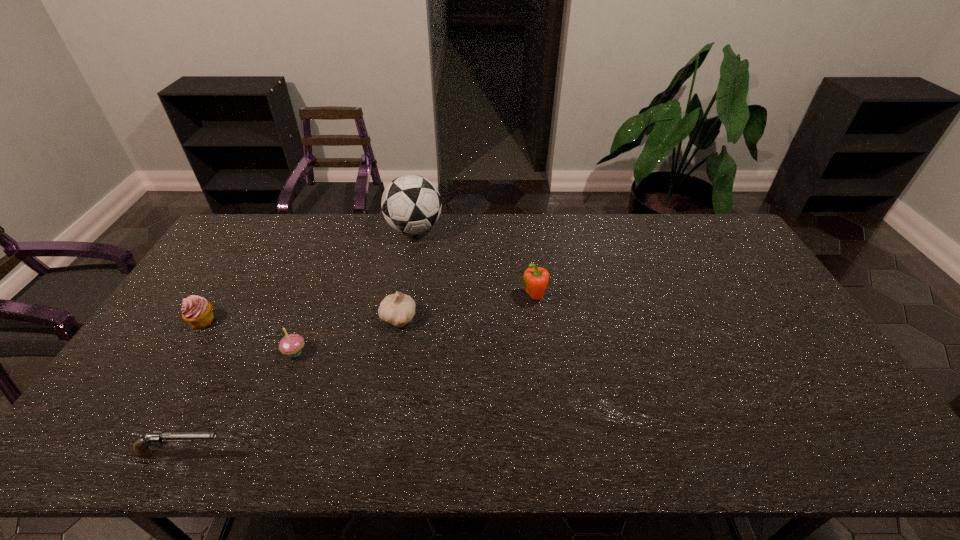
The width and height of the screenshot is (960, 540). What are the coordinates of `gun that is at the left edge` in the screenshot? It's located at (141, 447).

What are the coordinates of `object that is positioned at the near left corner` in the screenshot? It's located at (141, 447).

What are the coordinates of `vacant space at the far edge of the desktop` in the screenshot? It's located at point(510,224).

Where is `vacant space at the near edge`? This screenshot has width=960, height=540. vacant space at the near edge is located at coordinates (348, 436).

Where is `free space at the left edge`? free space at the left edge is located at coordinates (138, 411).

In order to click on vacant space at the right edge of the desktop in this screenshot , I will do click(x=752, y=318).

In the image, there is a desktop. Where is `vacant area at the far right corner`? This screenshot has height=540, width=960. vacant area at the far right corner is located at coordinates pos(732,232).

This screenshot has height=540, width=960. Identify the location of vacant area that lies between the nearest object and the garlic. (290, 386).

At what (x,y) coordinates should I click in order to perform the action: click on empty location between the rightmost object and the right cupcake. Please return your answer as a coordinate pair (x, y). The width and height of the screenshot is (960, 540). Looking at the image, I should click on (415, 325).

Find the location of `vacant point located between the second tallest object and the soccer ball`. vacant point located between the second tallest object and the soccer ball is located at coordinates (474, 264).